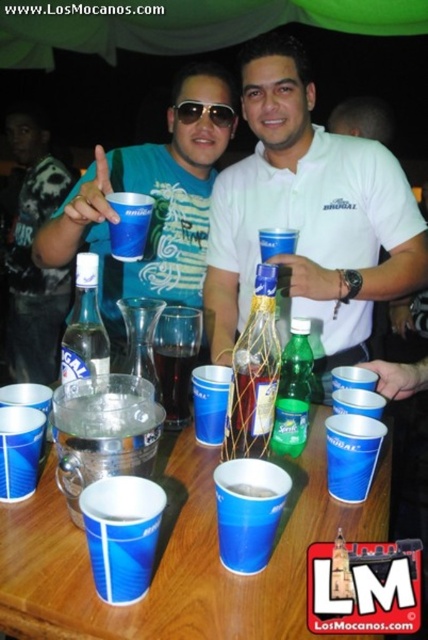
You are a photographer at the party and want to take a picture of the white matte shirt at center and the sunglasses at center. Since you want to focus on both objects, which one should you adjust your camera focus on first?

The white matte shirt at center is located below sunglasses at center, so you should focus on the sunglasses at center first as it is higher up and closer to the camera.

You are at a party and want to grab a drink from the table. There is a matte black shirt at center and a green glass bottle at center. Which one should you move first to reach the bottle?

The matte black shirt at center is above the green glass bottle at center, so you should move the matte black shirt at center first to access the bottle.